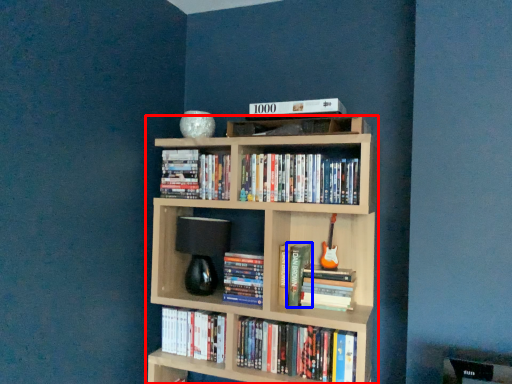
Question: Which of the following is the closest to the observer, bookcase (highlighted by a red box) or book (highlighted by a blue box)?

Choices:
 (A) bookcase
 (B) book

Answer: (A)